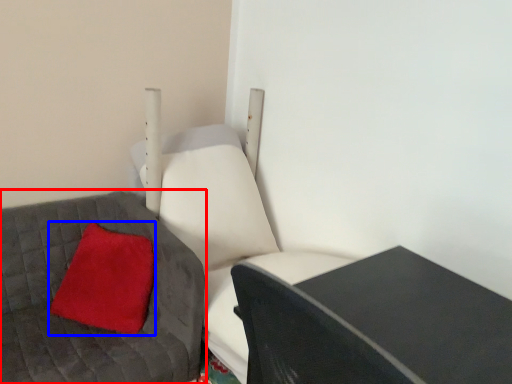
Question: Which point is further to the camera, furniture (highlighted by a red box) or pillow (highlighted by a blue box)?

Choices:
 (A) furniture
 (B) pillow

Answer: (B)